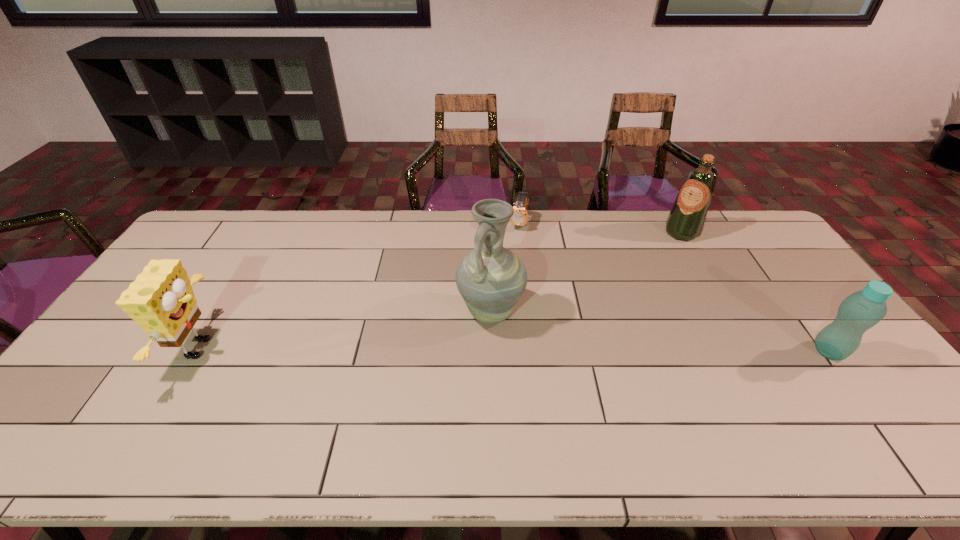
I want to click on free point between the rightmost object and the pitcher, so (660, 332).

Where is `vacant region between the pitcher and the second object from right to left`? vacant region between the pitcher and the second object from right to left is located at coordinates (586, 272).

This screenshot has width=960, height=540. I want to click on free area in between the tallest object and the sponge, so click(347, 330).

Locate an element on the screen. This screenshot has height=540, width=960. empty location between the sponge and the pitcher is located at coordinates (347, 330).

Identify which object is the fourth nearest to the shortest object. Please provide its 2D coordinates. Your answer should be formatted as a tuple, i.e. [(x, y)], where the tuple contains the x and y coordinates of a point satisfying the conditions above.

[(161, 300)]

Identify the location of object that is the second closest one to the pitcher. (686, 219).

Identify the location of blank area in the image that satisfies the following two spatial constraints: 1. on the back side of the tallest object; 2. on the right side of the olive oil. (489, 233).